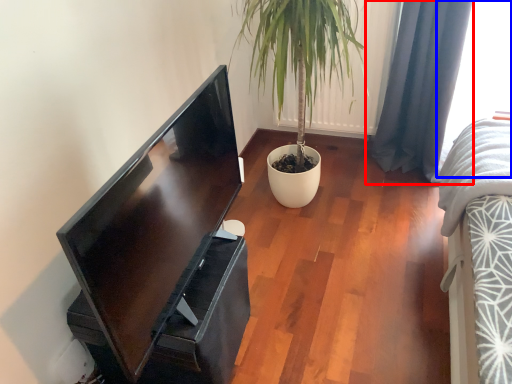
Question: Among these objects, which one is farthest to the camera, curtain (highlighted by a red box) or window (highlighted by a blue box)?

Choices:
 (A) curtain
 (B) window

Answer: (A)